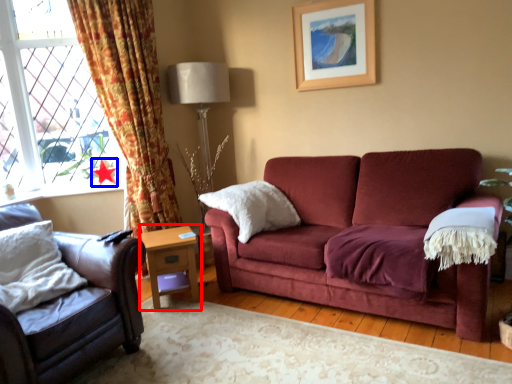
Question: Which object appears closest to the camera in this image, table (highlighted by a red box) or star (highlighted by a blue box)?

Choices:
 (A) table
 (B) star

Answer: (A)